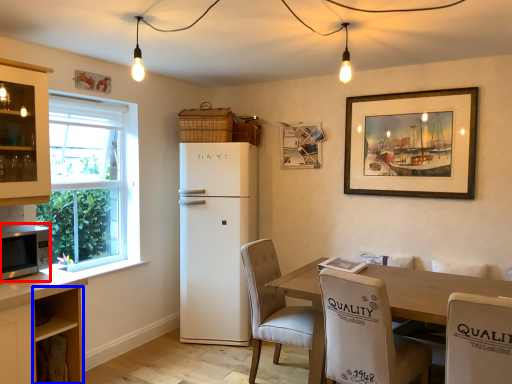
Question: Among these objects, which one is nearest to the camera, microwave oven (highlighted by a red box) or cabinetry (highlighted by a blue box)?

Choices:
 (A) microwave oven
 (B) cabinetry

Answer: (A)